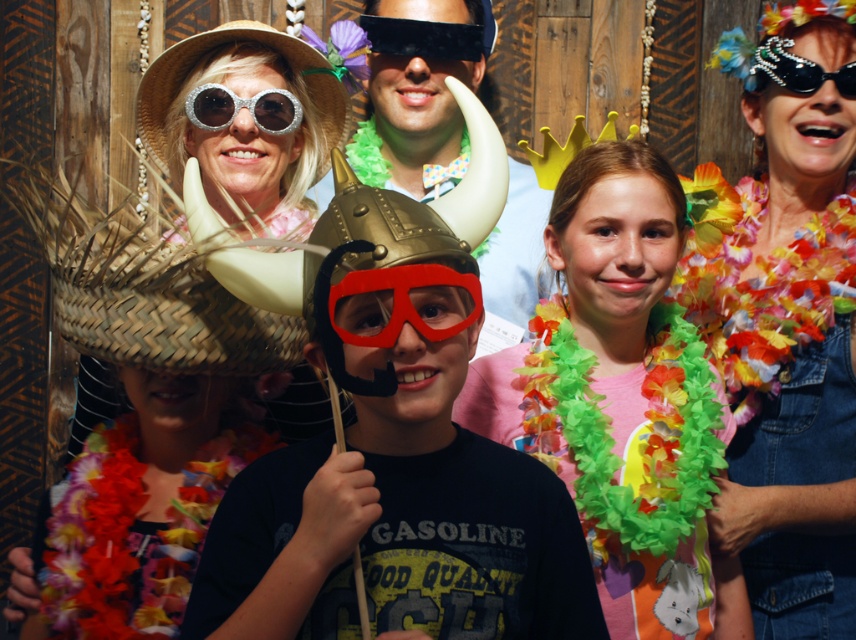
You are a photographer trying to capture a closeup of the glittery silver goggles at upper left and the denim dress at upper right. Based on their positions, which object is closer to the camera?

The glittery silver goggles at upper left are closer to the camera because they are positioned above the denim dress at upper right.

You are a photographer trying to adjust the lighting for the photo shoot. You need to place a spotlight so it can illuminate both the straw hat at upper left and the pearl encrusted sunglasses at upper right equally. Considering their sizes, which object should the spotlight be positioned closer to?

The spotlight should be positioned closer to the pearl encrusted sunglasses at upper right because the straw hat at upper left is larger in size, so to ensure equal illumination, the smaller object needs more focused light.